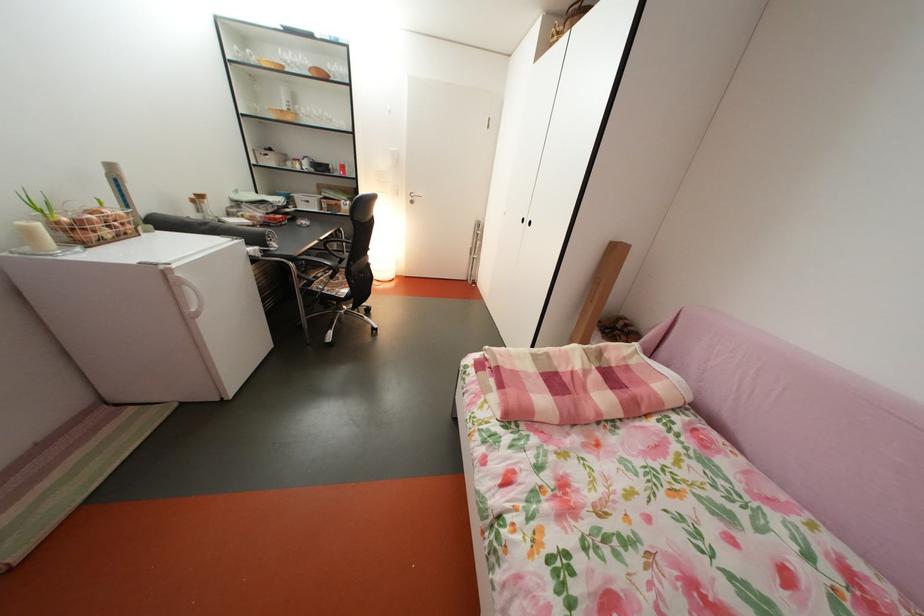
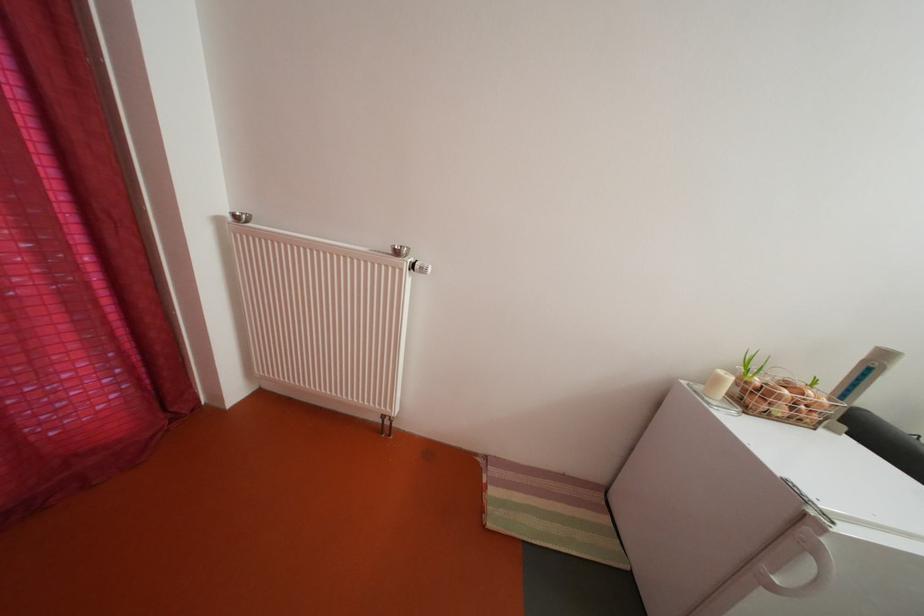
In the second image, find the point that corresponds to (41,238) in the first image.

(728, 386)